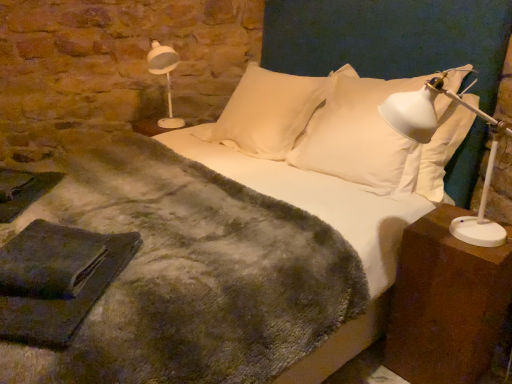
Find the location of a particular element. This screenshot has height=384, width=512. vacant space situated above brown wooden nightstand at right (from a real-world perspective) is located at coordinates (453, 236).